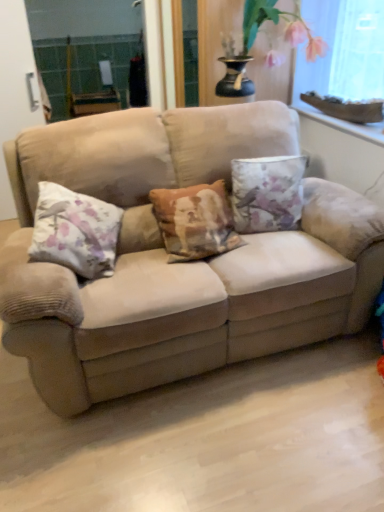
Question: From a real-world perspective, is transparent plastic window screen at upper right positioned above or below floral fabric cushion at center, the 2th pillow in the left-to-right sequence?

Choices:
 (A) below
 (B) above

Answer: (B)

Question: Based on their positions, is transparent plastic window screen at upper right located to the left or right of floral fabric cushion at center, which appears as the first pillow when viewed from the right?

Choices:
 (A) left
 (B) right

Answer: (B)

Question: Which object is positioned farthest from the clear glass screen door at left?

Choices:
 (A) floral bouquet at upper right
 (B) white stone window sill at upper right
 (C) floral fabric cushion at center, which appears as the first pillow when viewed from the right
 (D) transparent plastic window screen at upper right
 (E) beige fabric couch at center

Answer: (D)

Question: Which is nearer to the clear glass screen door at left?

Choices:
 (A) white stone window sill at upper right
 (B) floral fabric cushion at center, which appears as the first pillow when viewed from the right
 (C) floral bouquet at upper right
 (D) transparent plastic window screen at upper right
 (E) beige fabric couch at center

Answer: (E)